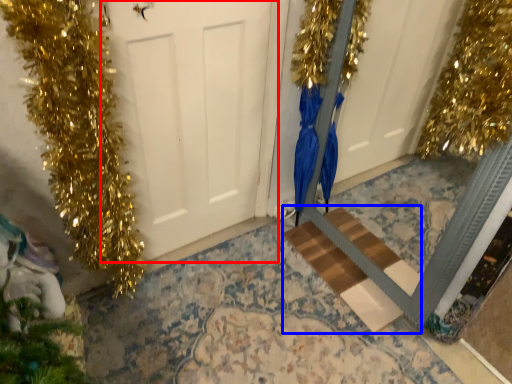
Question: Which object is further to the camera taking this photo, door (highlighted by a red box) or stairwell (highlighted by a blue box)?

Choices:
 (A) door
 (B) stairwell

Answer: (B)